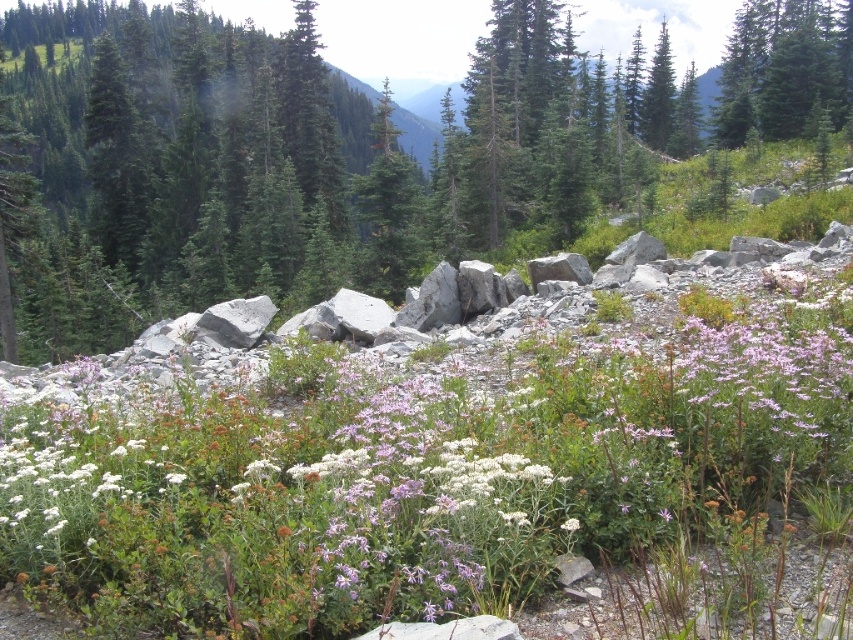
You are an ecologist studying the spatial arrangement of trees in this landscape. You observe the green matte tree at center and the green matte tree at upper right. Which tree is closer to the observer?

The green matte tree at center is closer to the observer because it is positioned in front of the green matte tree at upper right.

You are a hiker standing at the base of the green matte tree at center and want to reach the green matte tree at upper right. Which direction should you walk to get there?

You should walk towards the upper right direction to reach the green matte tree at upper right since it is located in that direction relative to the green matte tree at center.